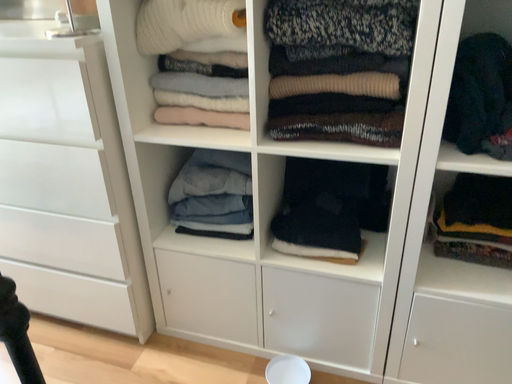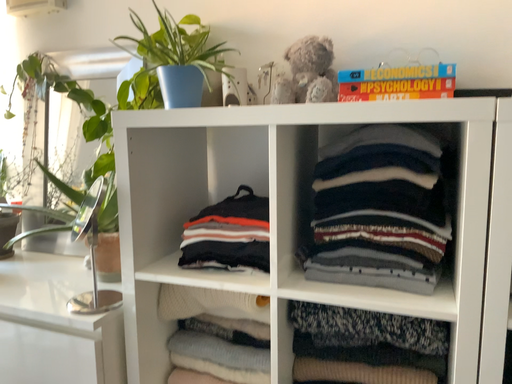
Question: How did the camera likely rotate when shooting the video?

Choices:
 (A) rotated upward
 (B) rotated downward

Answer: (A)